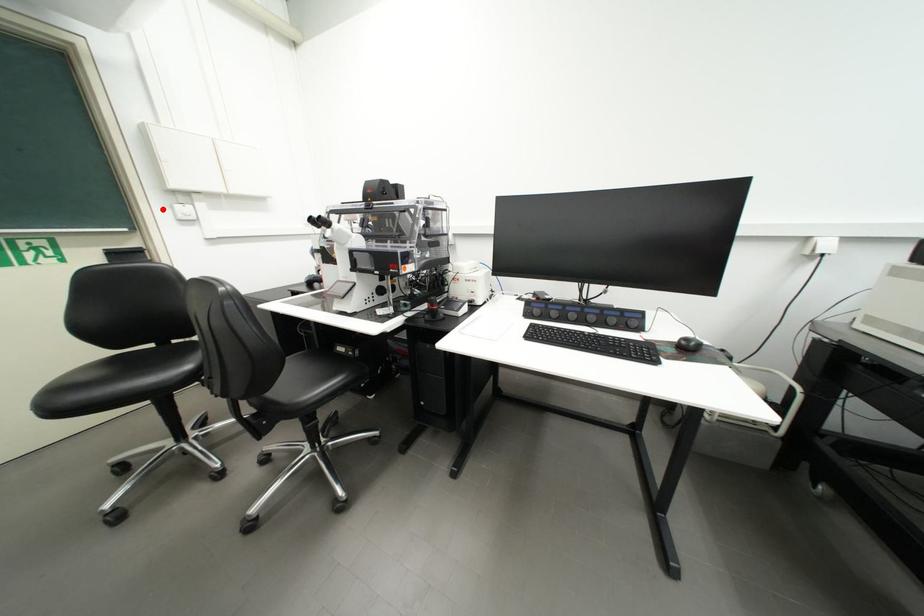
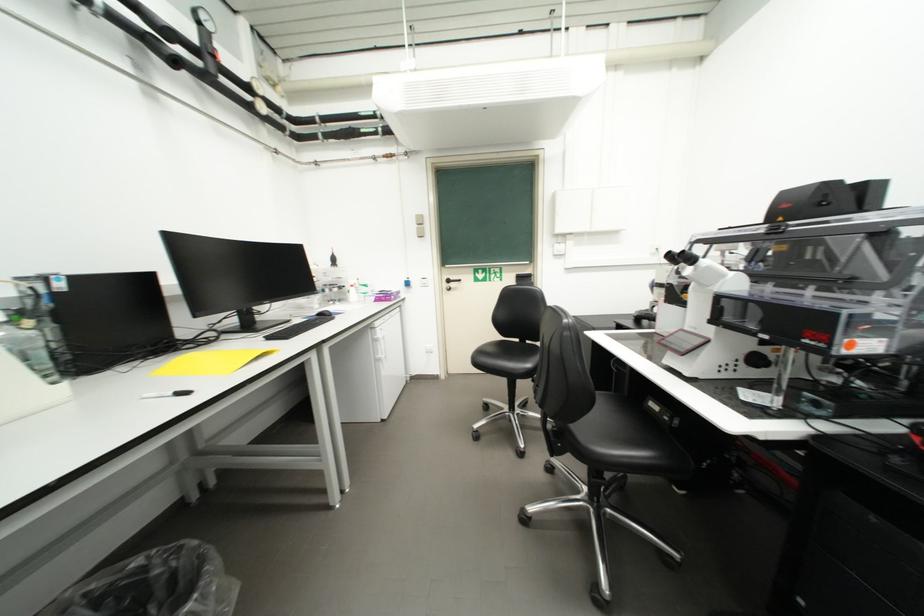
Find the pixel in the second image that matches the highlighted location in the first image.

(553, 249)